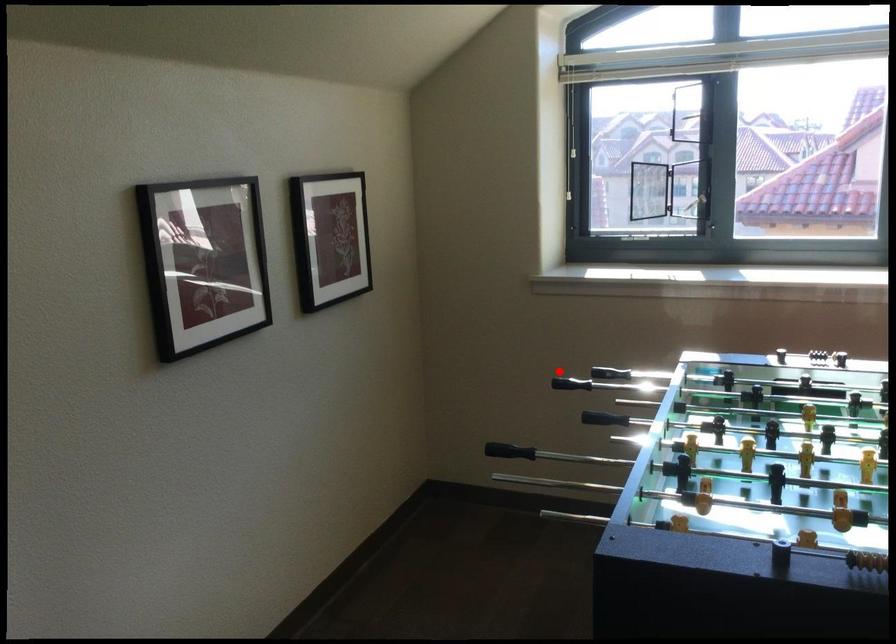
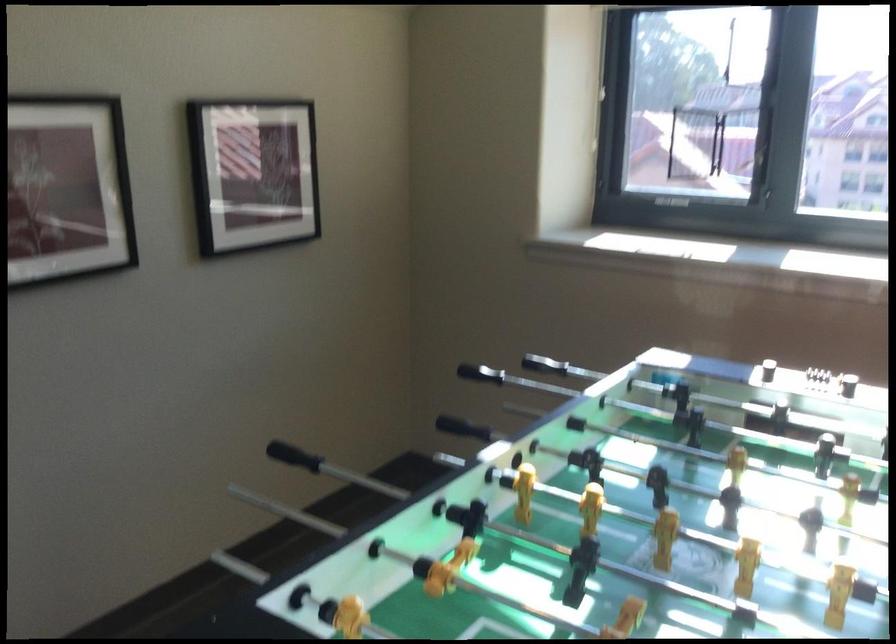
Locate, in the second image, the point that corresponds to the highlighted location in the first image.

(544, 365)